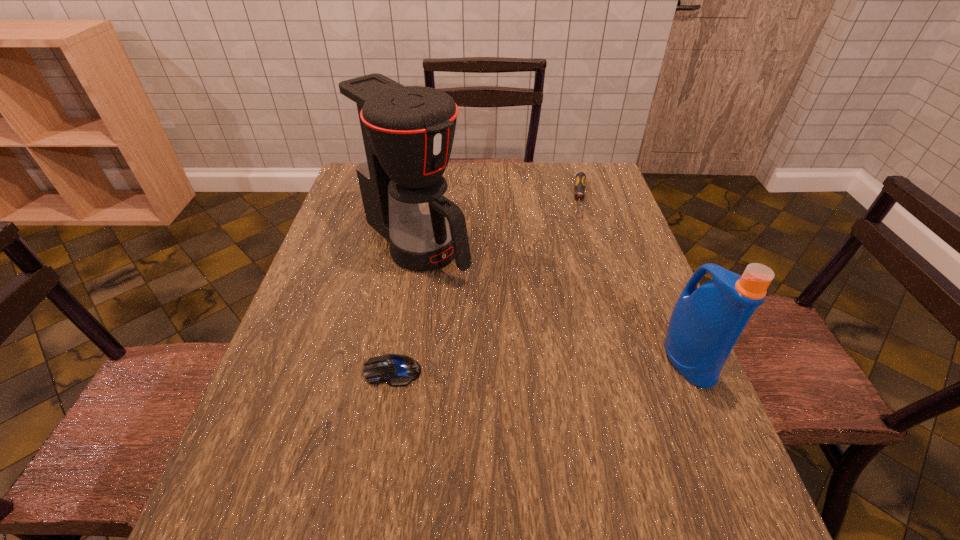
In the image, there is a desktop. Identify the location of blank space at the left edge. (325, 332).

In the image, there is a desktop. Where is `vacant region at the right edge`? The image size is (960, 540). vacant region at the right edge is located at coordinates (597, 245).

You are a GUI agent. You are given a task and a screenshot of the screen. Output one action in this format:
    pyautogui.click(x=<x>, y=<y>)
    Task: Click on the vacant space at the near left corner of the desktop
    Image resolution: width=960 pixels, height=540 pixels.
    Given the screenshot: What is the action you would take?
    click(x=295, y=471)

Where is `vacant region at the far right corner of the desktop`? This screenshot has height=540, width=960. vacant region at the far right corner of the desktop is located at coordinates (576, 170).

The image size is (960, 540). I want to click on vacant area that lies between the computer mouse and the tallest object, so click(x=404, y=307).

The height and width of the screenshot is (540, 960). Find the location of `unoccupied area between the coffee maker and the computer mouse`. unoccupied area between the coffee maker and the computer mouse is located at coordinates (404, 307).

Find the location of a particular element. The image size is (960, 540). vacant space that is in between the computer mouse and the rightmost object is located at coordinates (540, 365).

You are a GUI agent. You are given a task and a screenshot of the screen. Output one action in this format:
    pyautogui.click(x=<x>, y=<y>)
    Task: Click on the unoccupied area between the tallest object and the screwdriver
    The height and width of the screenshot is (540, 960).
    Given the screenshot: What is the action you would take?
    pyautogui.click(x=498, y=222)

At what (x,y) coordinates should I click in order to perform the action: click on vacant area that lies between the detergent and the tallest object. Please return your answer as a coordinate pair (x, y). The width and height of the screenshot is (960, 540). Looking at the image, I should click on (552, 301).

This screenshot has height=540, width=960. I want to click on vacant area that lies between the computer mouse and the screwdriver, so click(487, 285).